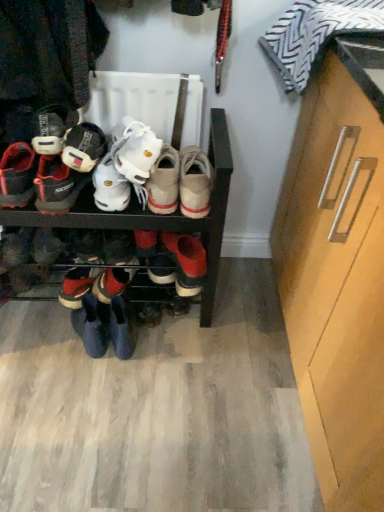
Question: From a real-world perspective, is black matte shoe rack at center above or below shiny black sneakers at lower left, which is the 4th footwear from right to left?

Choices:
 (A) above
 (B) below

Answer: (A)

Question: Is black matte shoe rack at center to the left or to the right of shiny black sneakers at lower left, acting as the third footwear starting from the left, in the image?

Choices:
 (A) left
 (B) right

Answer: (B)

Question: Estimate the real-world distances between objects in this image. Which object is farther from the shiny black sneakers at lower left, which is the 4th footwear from right to left?

Choices:
 (A) matte black shoe at left, arranged as the 5th footwear when viewed from the right
 (B) matte black sneakers at left, arranged as the first footwear when viewed from the left
 (C) white leather sneakers at center, which is counted as the third footwear, starting from the right
 (D) light brown wood cabinet at right
 (E) light brown suede shoe at center, the 1th footwear when ordered from right to left

Answer: (D)

Question: Estimate the real-world distances between objects in this image. Which object is closer to the light brown suede shoe at center, positioned as the sixth footwear in left-to-right order?

Choices:
 (A) white suede sneakers at center, acting as the second footwear starting from the right
 (B) light brown wood cabinet at right
 (C) shiny black sneakers at lower left, acting as the third footwear starting from the left
 (D) matte black shoe at left, arranged as the 5th footwear when viewed from the right
 (E) matte black sneakers at left, arranged as the first footwear when viewed from the left

Answer: (A)